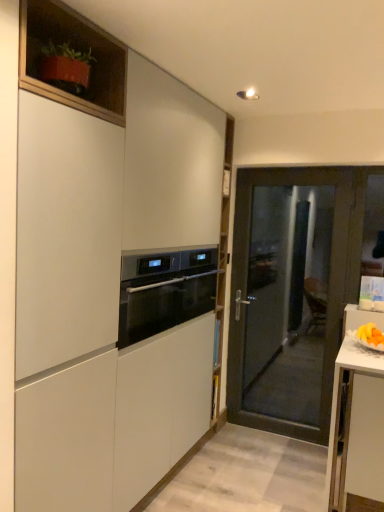
Question: From their relative heights in the image, would you say black glass oven at center is taller or shorter than matte wood cabinet at upper left, which appears as the first cabinetry when viewed from the top?

Choices:
 (A) short
 (B) tall

Answer: (B)

Question: Looking at their shapes, would you say black glass oven at center is wider or thinner than matte wood cabinet at upper left, the 2th cabinetry viewed from the front?

Choices:
 (A) wide
 (B) thin

Answer: (A)

Question: Which object is the closest to the matte wood cabinet at upper left, which appears as the first cabinetry when viewed from the back?

Choices:
 (A) matte white cabinet at center, acting as the 2th cabinetry starting from the back
 (B) transparent glass door at center
 (C) black glass oven at center

Answer: (A)

Question: Estimate the real-world distances between objects in this image. Which object is closer to the transparent glass door at center?

Choices:
 (A) black glass oven at center
 (B) matte wood cabinet at upper left, which appears as the first cabinetry when viewed from the top
 (C) matte white cabinet at center, the second cabinetry when ordered from top to bottom

Answer: (A)